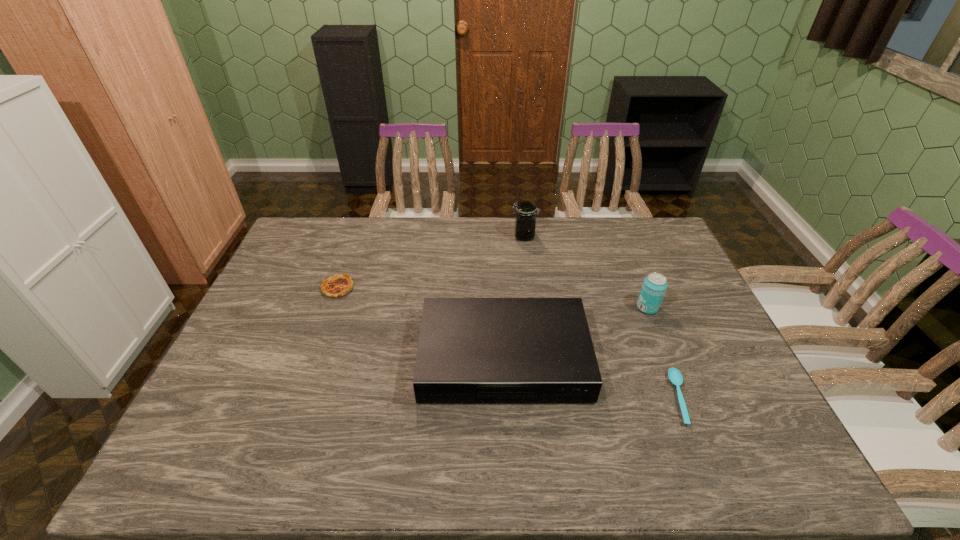
The width and height of the screenshot is (960, 540). Find the location of `the farthest object`. the farthest object is located at coordinates (525, 219).

The width and height of the screenshot is (960, 540). Find the location of `the third farthest object`. the third farthest object is located at coordinates (654, 286).

Find the location of `CD player`. CD player is located at coordinates (471, 350).

I want to click on quiche, so coord(336,286).

Locate an element on the screen. The height and width of the screenshot is (540, 960). the leftmost object is located at coordinates (336, 286).

Find the location of `the shortest object`. the shortest object is located at coordinates (675, 377).

I want to click on vacant space situated 0.160m on the lid of the jar, so click(467, 236).

You are a GUI agent. You are given a task and a screenshot of the screen. Output one action in this format:
    pyautogui.click(x=<x>, y=<y>)
    Task: Click on the vacant region located 0.100m on the lid of the jar
    The width and height of the screenshot is (960, 540).
    Given the screenshot: What is the action you would take?
    pyautogui.click(x=484, y=236)

Where is `vacant space located on the lid of the jar`? The height and width of the screenshot is (540, 960). vacant space located on the lid of the jar is located at coordinates (443, 236).

Where is `vacant space located on the left of the third farthest object`? This screenshot has width=960, height=540. vacant space located on the left of the third farthest object is located at coordinates (593, 307).